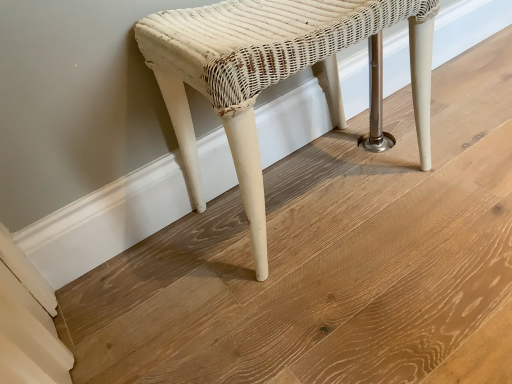
Where is `vacant area in front of white wicker stool at center`? This screenshot has width=512, height=384. vacant area in front of white wicker stool at center is located at coordinates (353, 296).